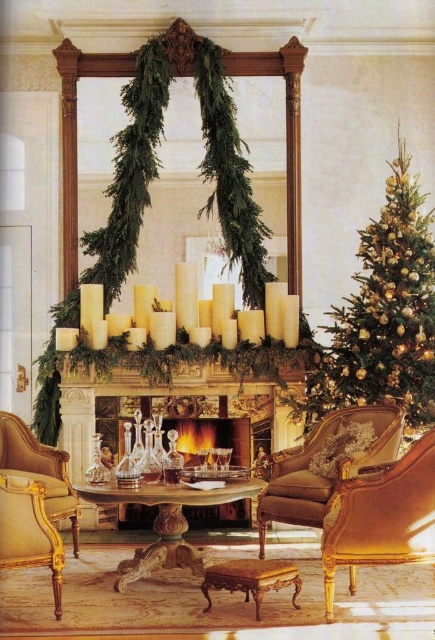
Which is more to the left, gold glittering ornaments at right or brown leather armchair at center?

brown leather armchair at center

What do you see at coordinates (382, 314) in the screenshot? I see `gold glittering ornaments at right` at bounding box center [382, 314].

At what (x,y) coordinates should I click in order to perform the action: click on gold glittering ornaments at right. Please return your answer as a coordinate pair (x, y). This screenshot has width=435, height=640. Looking at the image, I should click on (382, 314).

Does gold glittering ornaments at right have a lesser width compared to gold upholstered armchair at lower left?

In fact, gold glittering ornaments at right might be wider than gold upholstered armchair at lower left.

Who is more forward, (411, 346) or (46, 497)?

Positioned in front is point (46, 497).

The height and width of the screenshot is (640, 435). Identify the location of gold glittering ornaments at right. [382, 314].

Who is shorter, gold wood armchair at lower left or gold upholstered armchair at lower left?

gold wood armchair at lower left

Between point (10, 557) and point (10, 456), which one is positioned in front?

Point (10, 557) is in front.

I want to click on gold wood armchair at lower left, so click(29, 532).